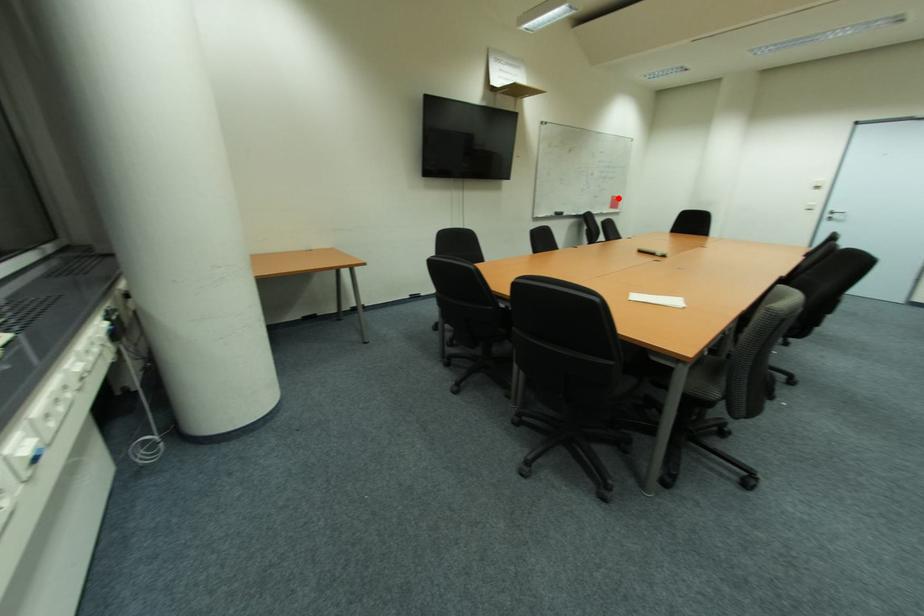
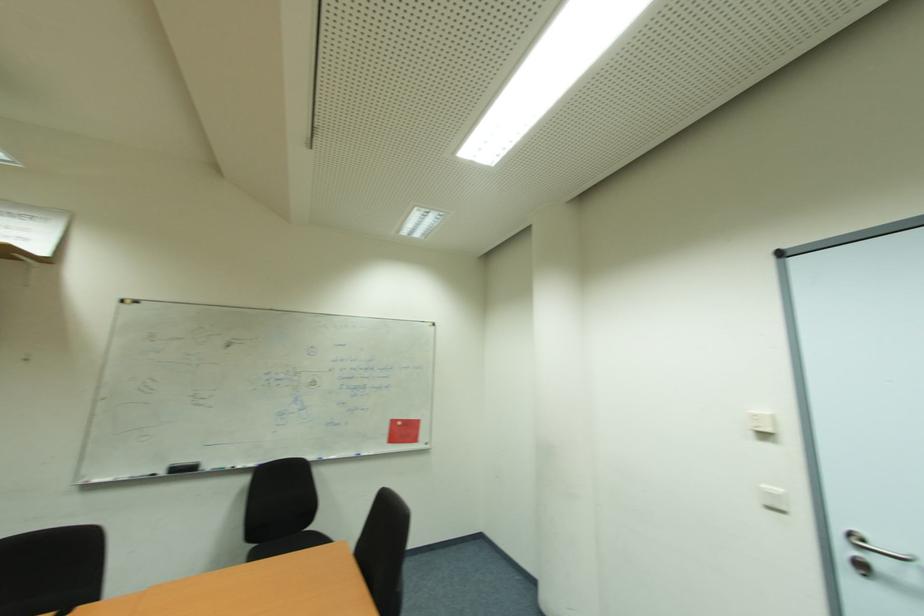
Find the pixel in the second image that matches the highlighted location in the first image.

(397, 423)